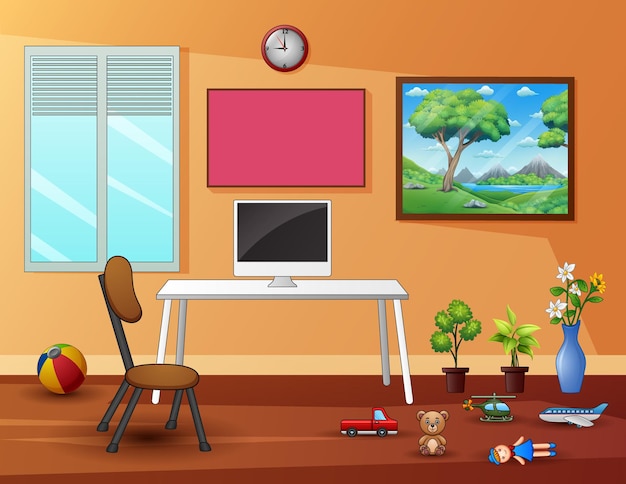
I want to click on window pane - right side, so [150, 237].